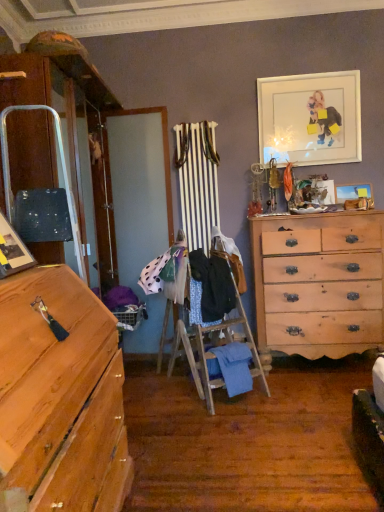
Question: Can you confirm if white matte picture frame at upper right, positioned as the third picture frame in bottom-to-top order, is shorter than wooden picture frame at upper right, positioned as the 2th picture frame in bottom-to-top order?

Choices:
 (A) no
 (B) yes

Answer: (A)

Question: Does white matte picture frame at upper right, which is the 2th picture frame in right-to-left order, have a greater width compared to wooden picture frame at upper right, positioned as the 2th picture frame in bottom-to-top order?

Choices:
 (A) no
 (B) yes

Answer: (A)

Question: Are white matte picture frame at upper right, positioned as the third picture frame in bottom-to-top order, and wooden picture frame at upper right, the 1th picture frame in the back-to-front sequence, located far from each other?

Choices:
 (A) no
 (B) yes

Answer: (A)

Question: Is white matte picture frame at upper right, the 1th picture frame from the top, located outside wooden picture frame at upper right, which is the third picture frame in left-to-right order?

Choices:
 (A) yes
 (B) no

Answer: (A)

Question: From a real-world perspective, is white matte picture frame at upper right, positioned as the third picture frame in bottom-to-top order, on wooden picture frame at upper right, the second picture frame when ordered from top to bottom?

Choices:
 (A) no
 (B) yes

Answer: (B)

Question: Is the depth of white matte picture frame at upper right, the 1th picture frame from the top, greater than that of wooden picture frame at upper right, which appears as the third picture frame when viewed from the front?

Choices:
 (A) yes
 (B) no

Answer: (B)

Question: From the image's perspective, is blue textured fabric at center, which ranks as the 3th clothing in top-to-bottom order, over light brown wooden chest of drawers at right?

Choices:
 (A) yes
 (B) no

Answer: (B)

Question: Is blue textured fabric at center, the 2th clothing positioned from the bottom, at the right side of light brown wooden chest of drawers at right?

Choices:
 (A) yes
 (B) no

Answer: (B)

Question: Is blue textured fabric at center, the 2th clothing positioned from the bottom, thinner than light brown wooden chest of drawers at right?

Choices:
 (A) no
 (B) yes

Answer: (B)

Question: Does blue textured fabric at center, the 2th clothing positioned from the bottom, contain light brown wooden chest of drawers at right?

Choices:
 (A) no
 (B) yes

Answer: (A)

Question: Could you tell me if blue textured fabric at center, the 2th clothing positioned from the bottom, is turned towards light brown wooden chest of drawers at right?

Choices:
 (A) no
 (B) yes

Answer: (B)

Question: Considering the relative sizes of blue textured fabric at center, the 2th clothing positioned from the bottom, and light brown wooden chest of drawers at right in the image provided, is blue textured fabric at center, the 2th clothing positioned from the bottom, wider than light brown wooden chest of drawers at right?

Choices:
 (A) no
 (B) yes

Answer: (A)

Question: From a real-world perspective, is blue textured fabric at center, which ranks as the 3th clothing in top-to-bottom order, beneath matte black picture frame at left, the 3th picture frame positioned from the back?

Choices:
 (A) no
 (B) yes

Answer: (B)